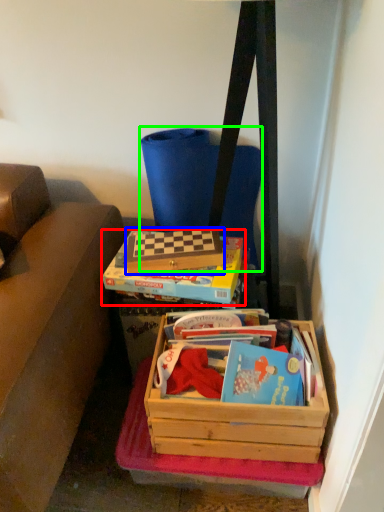
Question: Which object is positioned closest to box (highlighted by a red box)? Select from box (highlighted by a blue box) and messenger bag (highlighted by a green box).

Choices:
 (A) box
 (B) messenger bag

Answer: (A)